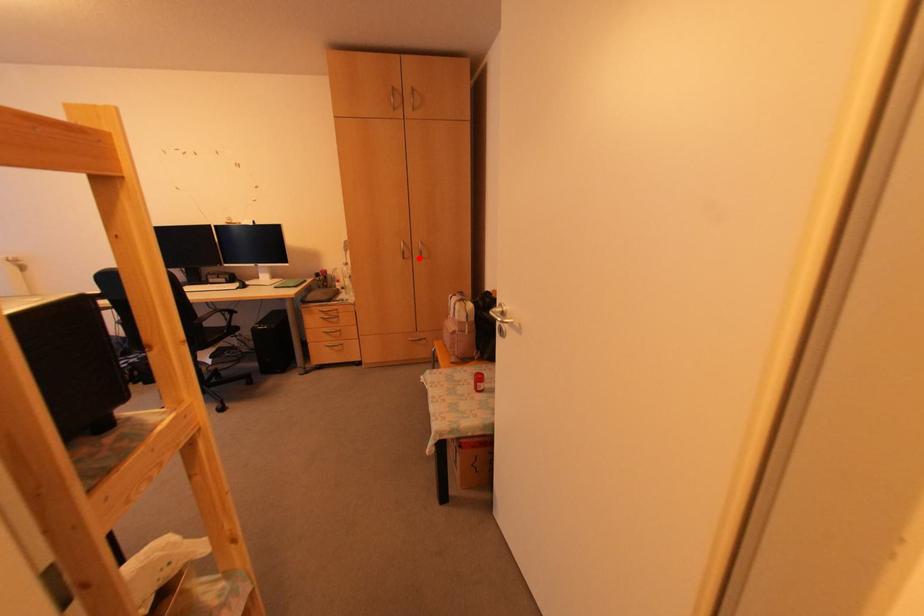
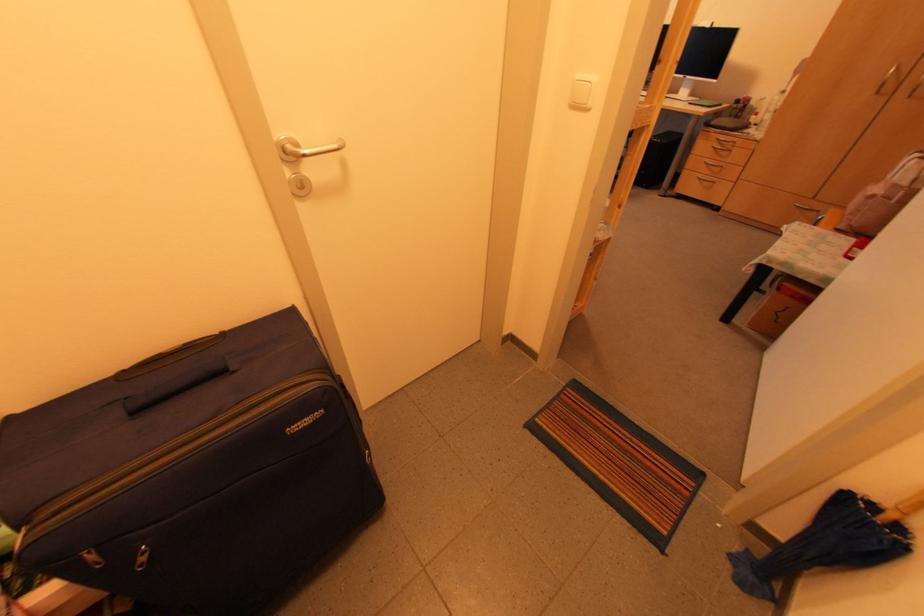
Question: I am providing you with two images of the same scene from different viewpoints. Given a red point in image1, look at the same physical point in image2. Is it:

Choices:
 (A) Closer to the viewpoint
 (B) Farther from the viewpoint

Answer: (B)